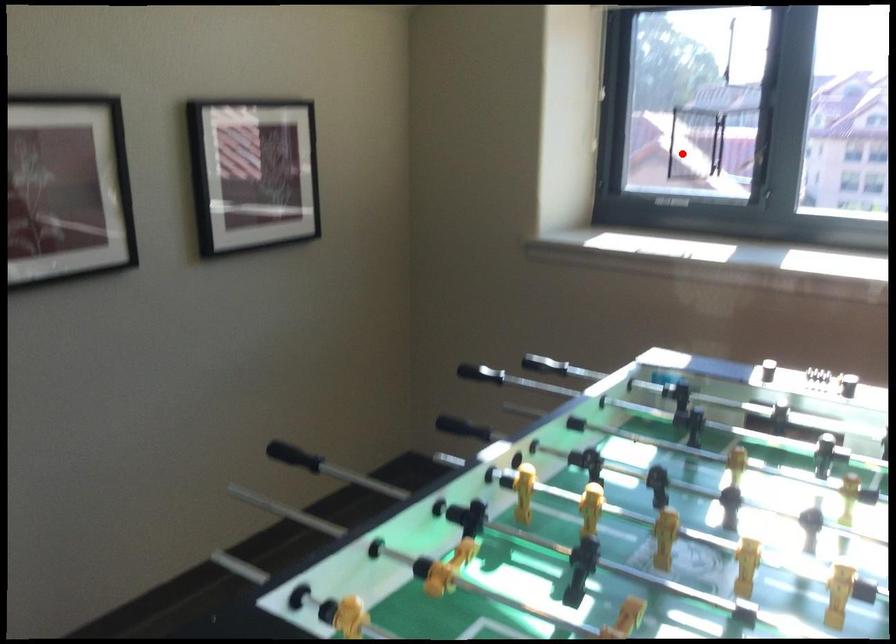
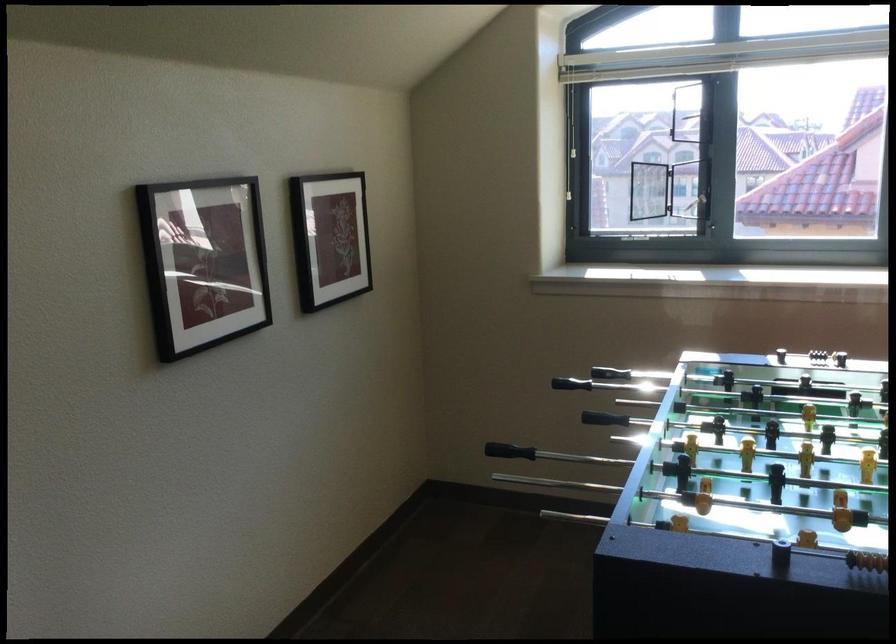
Question: I am providing you with two images of the same scene from different viewpoints. A red point is shown in image1. For the corresponding object point in image2, is it positioned nearer or farther from the camera?

Choices:
 (A) Nearer
 (B) Farther

Answer: (B)